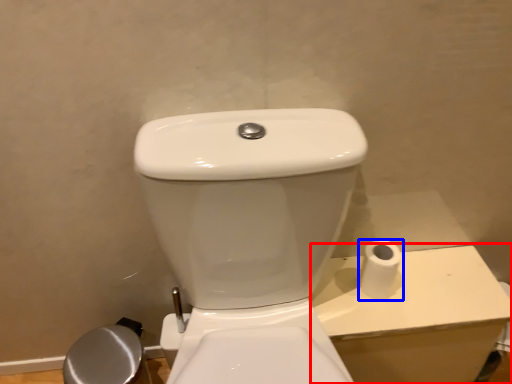
Question: Which object appears closest to the camera in this image, porcelain (highlighted by a red box) or toilet paper (highlighted by a blue box)?

Choices:
 (A) porcelain
 (B) toilet paper

Answer: (B)